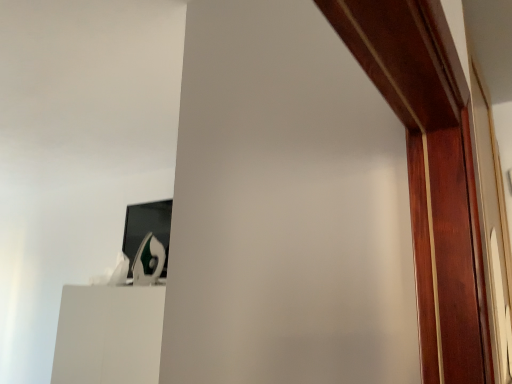
Question: Should I look upward or downward to see white glossy vanity at lower left?

Choices:
 (A) up
 (B) down

Answer: (B)